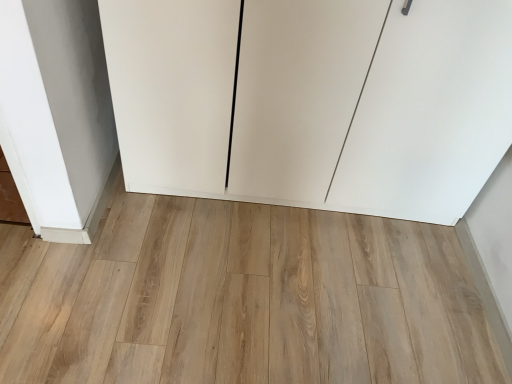
At what (x,y) coordinates should I click in order to perform the action: click on white matte cupboard at center. Please return your answer as a coordinate pair (x, y). This screenshot has width=512, height=384. Looking at the image, I should click on (313, 101).

What is the approximate height of white matte cupboard at center?

37.03 inches.

Describe the element at coordinates (313, 101) in the screenshot. The width and height of the screenshot is (512, 384). I see `white matte cupboard at center` at that location.

Where is `white matte cupboard at center`? The height and width of the screenshot is (384, 512). white matte cupboard at center is located at coordinates (313, 101).